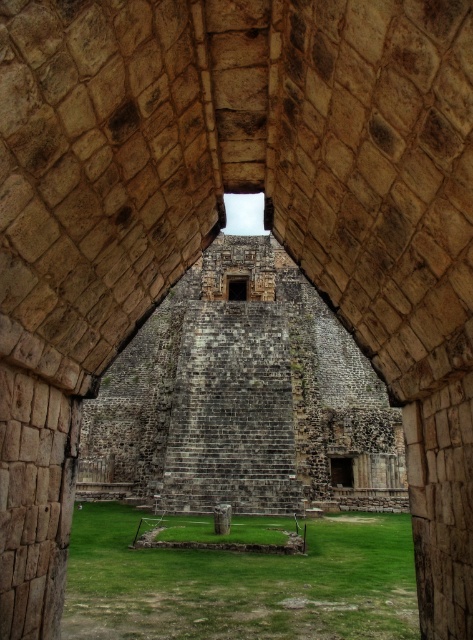
You are an archaeologist standing in front of the ancient stone archway. You notice two windows at the center of the structure. Which window is closer to you, the dark stone window at center or the transparent glass window at center?

The dark stone window at center is closer to you because it is in front of the transparent glass window at center.